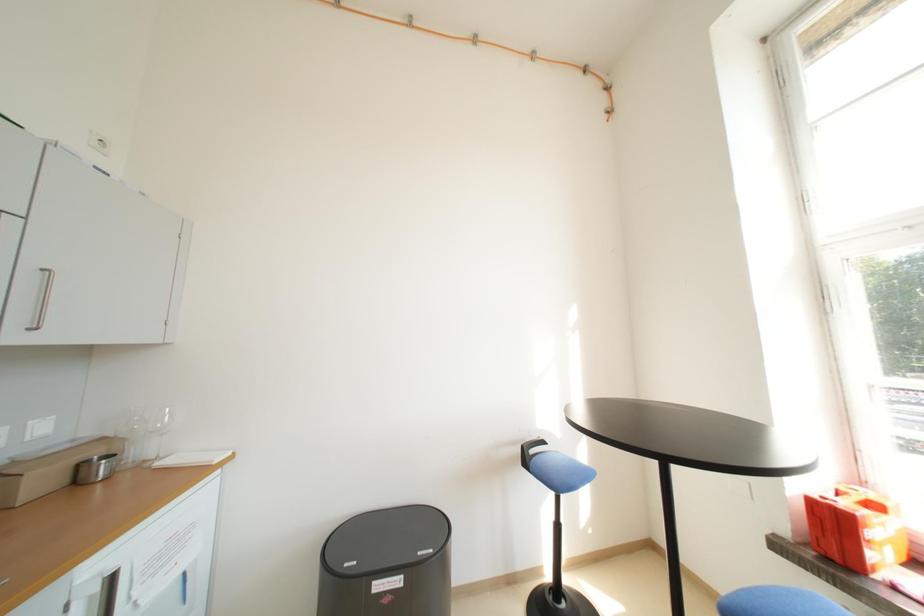
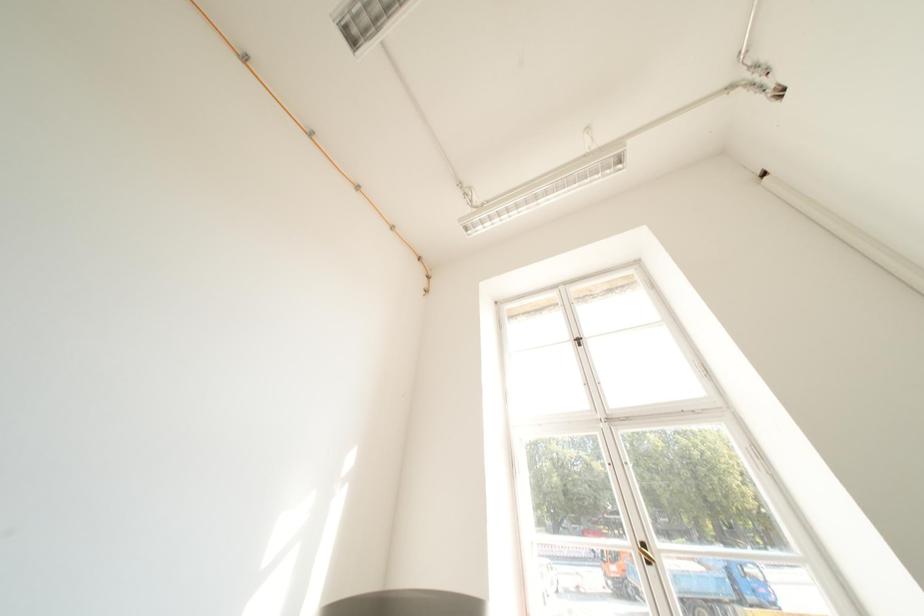
How did the camera likely rotate?

The camera's rotation is toward right-up.